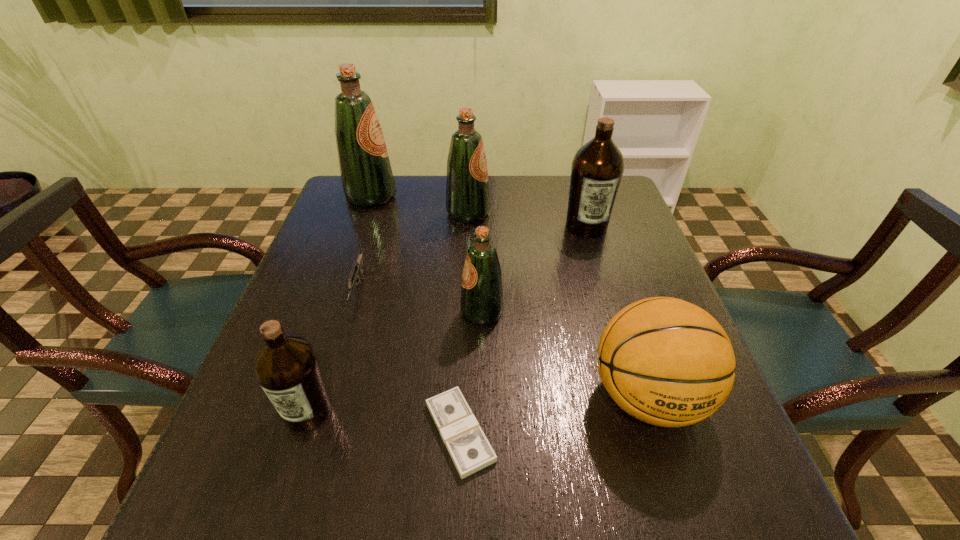
Image resolution: width=960 pixels, height=540 pixels. I want to click on the biggest green olive oil, so click(x=366, y=175).

Find the location of a particular element. Image resolution: width=960 pixels, height=540 pixels. the tallest object is located at coordinates (366, 175).

The height and width of the screenshot is (540, 960). I want to click on the second smallest green olive oil, so click(467, 188).

Find the location of `the bigger brown olive oil`. the bigger brown olive oil is located at coordinates (597, 168).

The height and width of the screenshot is (540, 960). Identify the location of the rightmost olive oil. (597, 168).

I want to click on the nearest green olive oil, so tap(481, 302).

Locate an element on the screen. the smallest green olive oil is located at coordinates (481, 302).

Find the location of a particular element. Image resolution: width=960 pixels, height=540 pixels. the nearest olive oil is located at coordinates (287, 368).

Identify the location of the nearer brown olive oil. The height and width of the screenshot is (540, 960). (287, 368).

Where is `basketball`? basketball is located at coordinates (667, 362).